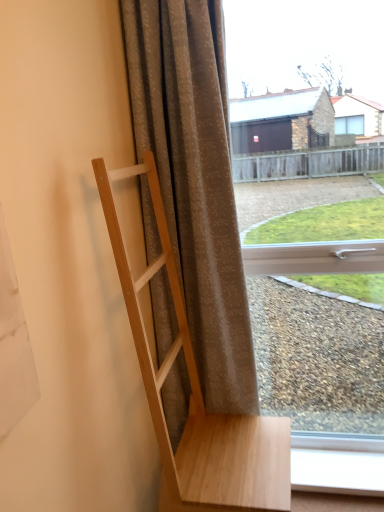
Question: Choose the correct answer: Is matte gray curtain at center inside white plastic window frame at lower right or outside it?

Choices:
 (A) inside
 (B) outside

Answer: (B)

Question: From their relative heights in the image, would you say matte gray curtain at center is taller or shorter than white plastic window frame at lower right?

Choices:
 (A) tall
 (B) short

Answer: (A)

Question: Estimate the real-world distances between objects in this image. Which object is farther from the natural wood coat rack at left?

Choices:
 (A) white plastic window frame at lower right
 (B) matte gray curtain at center
 (C) transparent glass window at center

Answer: (C)

Question: Which is farther from the transparent glass window at center?

Choices:
 (A) white plastic window frame at lower right
 (B) matte gray curtain at center
 (C) natural wood coat rack at left

Answer: (A)